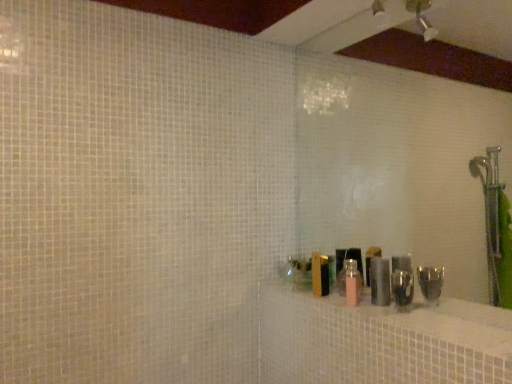
The image size is (512, 384). I want to click on free space above pink matte bottle at center (from a real-world perspective), so click(x=403, y=311).